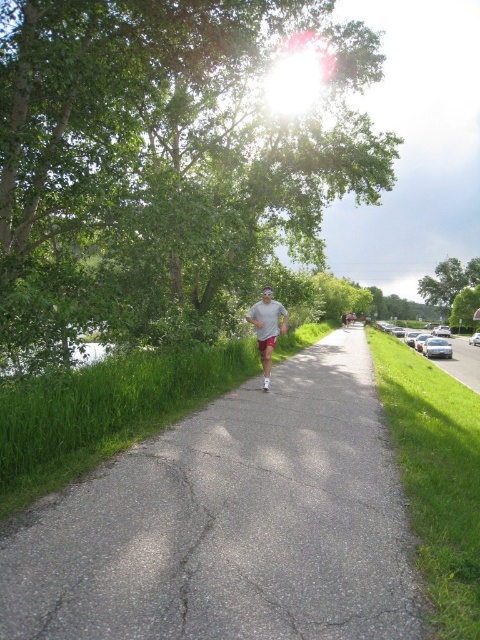
You are standing on the paved path in the image and want to walk towards the point labeled point (24, 228) and point (268, 353). Which point will you reach first?

You will reach point (24, 228) first because it is closer to you than point (268, 353).

Based on the scene, is the point at coordinates (x=165, y=161) located on the path or on a tree?

The point at coordinates (x=165, y=161) is on a green leafy tree at center, not on the path.